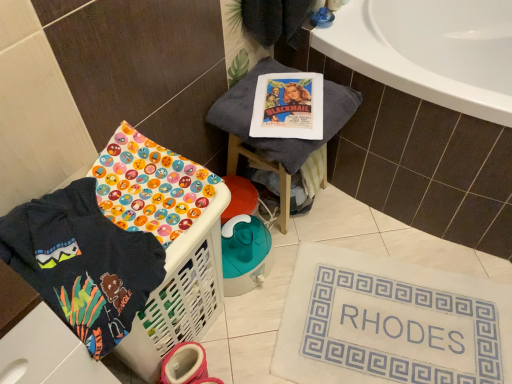
Question: Is gray fabric stool at upper center thinner than dark blue fabric at lower left?

Choices:
 (A) yes
 (B) no

Answer: (B)

Question: Does gray fabric stool at upper center have a greater width compared to dark blue fabric at lower left?

Choices:
 (A) no
 (B) yes

Answer: (B)

Question: Does gray fabric stool at upper center appear on the right side of dark blue fabric at lower left?

Choices:
 (A) yes
 (B) no

Answer: (A)

Question: Is gray fabric stool at upper center positioned with its back to dark blue fabric at lower left?

Choices:
 (A) yes
 (B) no

Answer: (B)

Question: Is gray fabric stool at upper center not near dark blue fabric at lower left?

Choices:
 (A) yes
 (B) no

Answer: (B)

Question: Is gray fabric stool at upper center bigger or smaller than white fabric bath mat at lower right?

Choices:
 (A) small
 (B) big

Answer: (B)

Question: Looking at their shapes, would you say gray fabric stool at upper center is wider or thinner than white fabric bath mat at lower right?

Choices:
 (A) wide
 (B) thin

Answer: (B)

Question: Is gray fabric stool at upper center spatially inside white fabric bath mat at lower right, or outside of it?

Choices:
 (A) inside
 (B) outside

Answer: (B)

Question: From a real-world perspective, is gray fabric stool at upper center physically located above or below white fabric bath mat at lower right?

Choices:
 (A) above
 (B) below

Answer: (A)

Question: Is white fabric bath mat at lower right wider or thinner than dark blue fabric at lower left?

Choices:
 (A) thin
 (B) wide

Answer: (B)

Question: Is point (314, 314) positioned closer to the camera than point (56, 248)?

Choices:
 (A) farther
 (B) closer

Answer: (A)

Question: From the image's perspective, is white fabric bath mat at lower right positioned above or below dark blue fabric at lower left?

Choices:
 (A) below
 (B) above

Answer: (A)

Question: Is white fabric bath mat at lower right bigger or smaller than dark blue fabric at lower left?

Choices:
 (A) small
 (B) big

Answer: (B)

Question: Is white plastic laundry basket at lower left taller or shorter than gray fabric stool at upper center?

Choices:
 (A) short
 (B) tall

Answer: (B)

Question: Based on their positions, is white plastic laundry basket at lower left located to the left or right of gray fabric stool at upper center?

Choices:
 (A) left
 (B) right

Answer: (A)